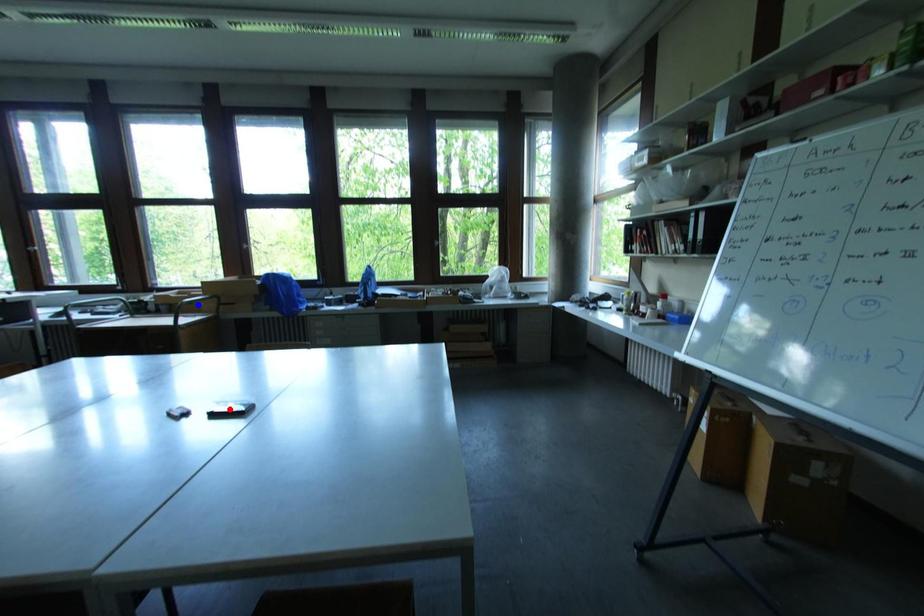
Question: In the image, two points are highlighted. Which point is nearer to the camera? Reply with the corresponding letter.

Choices:
 (A) blue point
 (B) red point

Answer: (B)